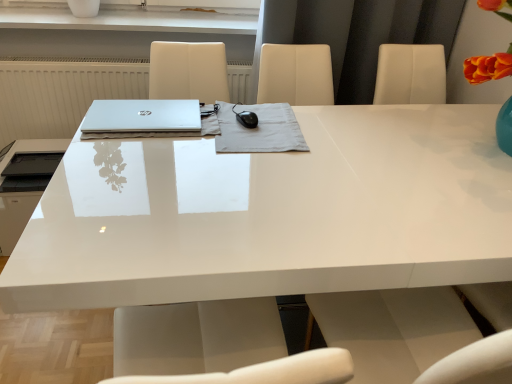
Describe the element at coordinates (15, 216) in the screenshot. The height and width of the screenshot is (384, 512). I see `matte black printer at left` at that location.

What do you see at coordinates (283, 244) in the screenshot? This screenshot has width=512, height=384. I see `white glossy desk at center` at bounding box center [283, 244].

Locate an element on the screen. The height and width of the screenshot is (384, 512). satin black mouse at center is located at coordinates (259, 130).

The image size is (512, 384). Find the location of `sleek silver laptop at center`. sleek silver laptop at center is located at coordinates (143, 116).

Identify the location of matte black printer at left. Image resolution: width=512 pixels, height=384 pixels. (15, 216).

Would you say white glossy vase at upper center is inside or outside satin black mouse at center?

white glossy vase at upper center exists outside the volume of satin black mouse at center.

From the image's perspective, is white glossy vase at upper center below satin black mouse at center?

No, from the image's perspective, white glossy vase at upper center is not below satin black mouse at center.

Is white glossy vase at upper center closer to camera compared to satin black mouse at center?

No.

How far apart are white glossy vase at upper center and satin black mouse at center?

white glossy vase at upper center is 35.74 inches away from satin black mouse at center.

Could you tell me if white glossy desk at center is turned towards white glossy vase at upper center?

No, white glossy desk at center does not turn towards white glossy vase at upper center.

From a real-world perspective, between white glossy desk at center and white glossy vase at upper center, who is vertically lower?

In real-world perspective, white glossy desk at center is lower.

Which is in front, point (258, 192) or point (249, 25)?

The point (258, 192) is closer to the camera.

From a real-world perspective, is white glossy desk at center under satin black mouse at center?

Correct, in the physical world, white glossy desk at center is lower than satin black mouse at center.

In the scene shown: Considering the relative positions of white glossy desk at center and satin black mouse at center in the image provided, is white glossy desk at center to the left of satin black mouse at center from the viewer's perspective?

No.

Are white glossy desk at center and satin black mouse at center located far from each other?

No.

From their relative heights in the image, would you say white glossy desk at center is taller or shorter than satin black mouse at center?

In the image, white glossy desk at center appears to be taller than satin black mouse at center.

Is matte black printer at left wider or thinner than satin black mouse at center?

matte black printer at left is wider than satin black mouse at center.

From the picture: Can satin black mouse at center be found inside matte black printer at left?

No, satin black mouse at center is not surrounded by matte black printer at left.

From a real-world perspective, relative to satin black mouse at center, is matte black printer at left vertically above or below?

From a real-world perspective, matte black printer at left is physically below satin black mouse at center.

What's the angular difference between matte black printer at left and satin black mouse at center's facing directions?

The angular difference between matte black printer at left and satin black mouse at center is 89.4 degrees.

Does white glossy vase at upper center have a lesser height compared to white glossy desk at center?

Yes.

Looking at their sizes, would you say white glossy vase at upper center is wider or thinner than white glossy desk at center?

Considering their sizes, white glossy vase at upper center looks slimmer than white glossy desk at center.

Who is more distant, white glossy vase at upper center or white glossy desk at center?

white glossy vase at upper center is further away from the camera.

How much distance is there between white glossy vase at upper center and white glossy desk at center?

They are 4.11 feet apart.

Is satin black mouse at center completely or partially outside of white glossy desk at center?

Actually, satin black mouse at center is at least partially inside white glossy desk at center.

From the image's perspective, between satin black mouse at center and white glossy desk at center, who is located below?

white glossy desk at center is shown below in the image.

Looking at this image, is satin black mouse at center shorter than white glossy desk at center?

Indeed, satin black mouse at center has a lesser height compared to white glossy desk at center.

Are matte black printer at left and sleek silver laptop at center far apart?

No, matte black printer at left is not far away from sleek silver laptop at center.

From the image's perspective, which is above, matte black printer at left or sleek silver laptop at center?

sleek silver laptop at center appears higher in the image.

Which is nearer, [22,148] or [135,100]?

Clearly, point [22,148] is more distant from the camera than point [135,100].

The width and height of the screenshot is (512, 384). In order to click on notebook below the white glossy vase at upper center (from the image's perspective) in this screenshot , I will do `click(259, 130)`.

The image size is (512, 384). What are the coordinates of `window sill above the white glossy desk at center (from a real-world perspective)` in the screenshot? It's located at (126, 18).

From the image, which object appears to be nearer to white glossy desk at center, sleek silver laptop at center or matte black printer at left?

sleek silver laptop at center.

From the image, which object appears to be farther from white glossy vase at upper center, white glossy desk at center or satin black mouse at center?

white glossy desk at center.

Based on their spatial positions, is sleek silver laptop at center or matte black printer at left closer to white glossy vase at upper center?

Based on the image, sleek silver laptop at center appears to be nearer to white glossy vase at upper center.

From the image, which object appears to be farther from matte black printer at left, sleek silver laptop at center or white glossy vase at upper center?

white glossy vase at upper center lies further to matte black printer at left than the other object.

Estimate the real-world distances between objects in this image. Which object is closer to matte black printer at left, satin black mouse at center or sleek silver laptop at center?

sleek silver laptop at center lies closer to matte black printer at left than the other object.

Based on the photo, which object lies nearer to the anchor point satin black mouse at center, white glossy desk at center or matte black printer at left?

Based on the image, white glossy desk at center appears to be nearer to satin black mouse at center.

Based on their spatial positions, is sleek silver laptop at center or matte black printer at left further from satin black mouse at center?

Based on the image, matte black printer at left appears to be further to satin black mouse at center.

Estimate the real-world distances between objects in this image. Which object is further from white glossy desk at center, matte black printer at left or white glossy vase at upper center?

white glossy vase at upper center is further to white glossy desk at center.

Identify the location of notebook between white glossy desk at center and white glossy vase at upper center along the z-axis. (259, 130).

I want to click on laptop between white glossy vase at upper center and satin black mouse at center in the horizontal direction, so click(143, 116).

This screenshot has width=512, height=384. Find the location of `laptop located between matte black printer at left and white glossy desk at center in the left-right direction`. laptop located between matte black printer at left and white glossy desk at center in the left-right direction is located at coordinates (143, 116).

Locate an element on the screen. Image resolution: width=512 pixels, height=384 pixels. notebook situated between matte black printer at left and white glossy desk at center from left to right is located at coordinates (259, 130).